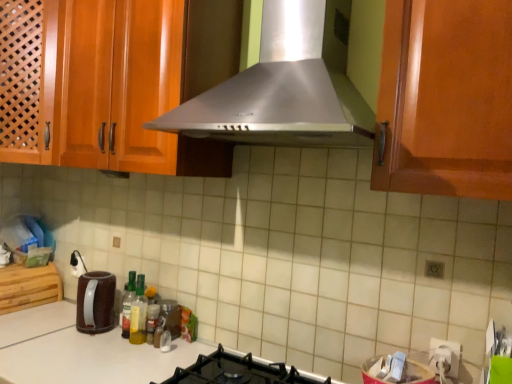
Question: From the image's perspective, is translucent plastic bottle at center, the 1th bottle when ordered from right to left, on black matte gas stove at lower center?

Choices:
 (A) no
 (B) yes

Answer: (B)

Question: Is translucent plastic bottle at center, the 1th bottle when ordered from right to left, oriented towards black matte gas stove at lower center?

Choices:
 (A) yes
 (B) no

Answer: (B)

Question: Is translucent plastic bottle at center, the 1th bottle when ordered from right to left, at the right side of black matte gas stove at lower center?

Choices:
 (A) no
 (B) yes

Answer: (A)

Question: From a real-world perspective, does translucent plastic bottle at center, the 3th bottle in the left-to-right sequence, stand above black matte gas stove at lower center?

Choices:
 (A) yes
 (B) no

Answer: (A)

Question: Can you confirm if translucent plastic bottle at center, the 3th bottle in the left-to-right sequence, is shorter than black matte gas stove at lower center?

Choices:
 (A) no
 (B) yes

Answer: (A)

Question: In the image, is brown matte electric kettle at lower left on the left side or the right side of translucent plastic bottle at center, the 3th bottle in the left-to-right sequence?

Choices:
 (A) left
 (B) right

Answer: (A)

Question: Is brown matte electric kettle at lower left taller or shorter than translucent plastic bottle at center, the 3th bottle in the left-to-right sequence?

Choices:
 (A) short
 (B) tall

Answer: (B)

Question: From a real-world perspective, is brown matte electric kettle at lower left physically located above or below translucent plastic bottle at center, the 3th bottle in the left-to-right sequence?

Choices:
 (A) above
 (B) below

Answer: (A)

Question: Considering the positions of point (110, 294) and point (158, 311), is point (110, 294) closer or farther from the camera than point (158, 311)?

Choices:
 (A) farther
 (B) closer

Answer: (A)

Question: Which is correct: wooden cutting board at lower left is inside black matte gas stove at lower center, or outside of it?

Choices:
 (A) outside
 (B) inside

Answer: (A)

Question: Is wooden cutting board at lower left bigger or smaller than black matte gas stove at lower center?

Choices:
 (A) big
 (B) small

Answer: (A)

Question: Considering the positions of point (40, 292) and point (225, 360), is point (40, 292) closer or farther from the camera than point (225, 360)?

Choices:
 (A) farther
 (B) closer

Answer: (A)

Question: Relative to black matte gas stove at lower center, is wooden cutting board at lower left in front or behind?

Choices:
 (A) behind
 (B) front

Answer: (A)

Question: Is translucent glass bottle at center, the 1th bottle from the left, inside or outside of brown matte electric kettle at lower left?

Choices:
 (A) outside
 (B) inside

Answer: (A)

Question: Is translucent glass bottle at center, the 1th bottle from the left, bigger or smaller than brown matte electric kettle at lower left?

Choices:
 (A) small
 (B) big

Answer: (A)